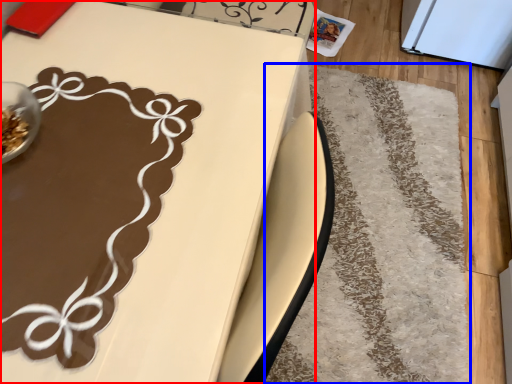
Question: Among these objects, which one is farthest to the camera, table (highlighted by a red box) or mat (highlighted by a blue box)?

Choices:
 (A) table
 (B) mat

Answer: (B)